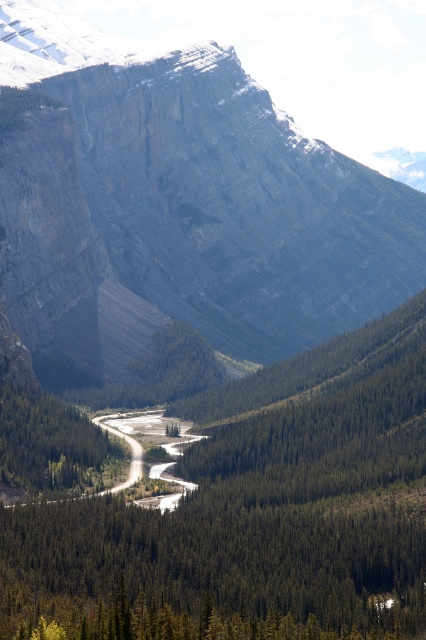
You are a hiker standing at the base of the gray rock cliff at upper center. You want to reach the summit, which is at the top of the cliff. Given that the cliff is 917.15 feet away from you, do you think it is feasible to climb it in one day?

The gray rock cliff at upper center is 917.15 feet away from the viewer. However, the distance to the summit would depend on the actual height of the cliff rather than the horizontal distance. Since the description does not provide the vertical height, it is impossible to determine if it can be climbed in one day based on the given information.

You are a hiker planning to cross the gravel road at center. To avoid the steep slope of the gray rock cliff at upper center, which direction should you head relative to the road?

The gray rock cliff at upper center is on the left side of the gravel road at center. To avoid the steep slope, you should head to the right side of the gravel road at center.